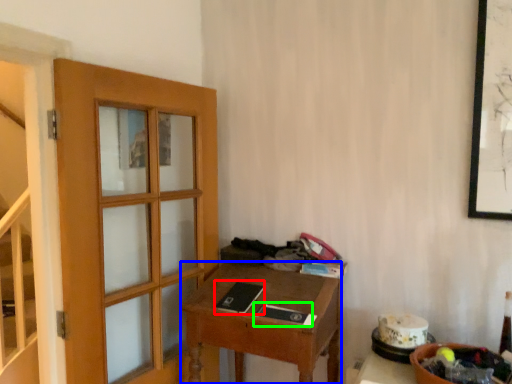
Question: Based on their relative distances, which object is farther from book (highlighted by a red box)? Choose from desk (highlighted by a blue box) and book (highlighted by a green box).

Choices:
 (A) desk
 (B) book

Answer: (A)